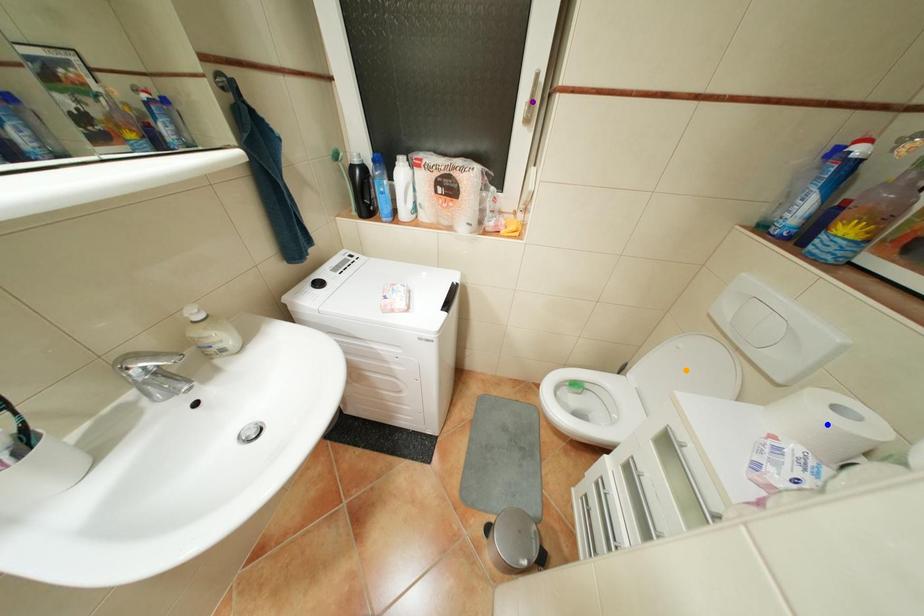
Order these from nearest to farthest:
orange point | blue point | purple point

blue point, purple point, orange point